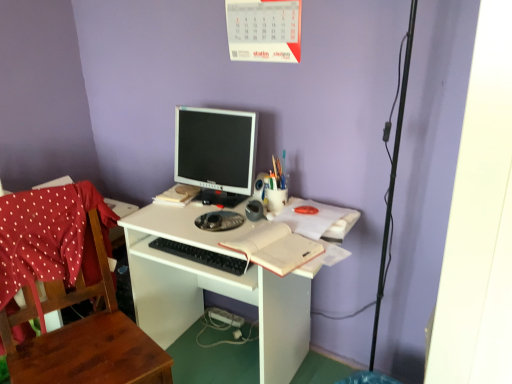
Question: Is white matte notebook at center placed right next to wooden chair at left?

Choices:
 (A) yes
 (B) no

Answer: (B)

Question: Does white matte notebook at center appear on the left side of wooden chair at left?

Choices:
 (A) yes
 (B) no

Answer: (B)

Question: Does white matte notebook at center appear on the right side of wooden chair at left?

Choices:
 (A) yes
 (B) no

Answer: (A)

Question: Is white matte notebook at center oriented towards wooden chair at left?

Choices:
 (A) yes
 (B) no

Answer: (B)

Question: Is wooden chair at left completely or partially inside white matte notebook at center?

Choices:
 (A) no
 (B) yes

Answer: (A)

Question: In the image, is white matte desk at center positioned in front of or behind black plastic keyboard at center?

Choices:
 (A) front
 (B) behind

Answer: (A)

Question: Does point (257, 268) appear closer or farther from the camera than point (241, 269)?

Choices:
 (A) farther
 (B) closer

Answer: (B)

Question: In terms of width, does white matte desk at center look wider or thinner when compared to black plastic keyboard at center?

Choices:
 (A) thin
 (B) wide

Answer: (B)

Question: From the image's perspective, is white matte desk at center located above or below black plastic keyboard at center?

Choices:
 (A) above
 (B) below

Answer: (B)

Question: Looking at the image, does multicolored plastic pen holder at center seem bigger or smaller compared to matte black monitor at center?

Choices:
 (A) small
 (B) big

Answer: (A)

Question: Is multicolored plastic pen holder at center situated inside matte black monitor at center or outside?

Choices:
 (A) inside
 (B) outside

Answer: (B)

Question: Would you say multicolored plastic pen holder at center is to the left or to the right of matte black monitor at center in the picture?

Choices:
 (A) left
 (B) right

Answer: (B)

Question: Considering the positions of multicolored plastic pen holder at center and matte black monitor at center in the image, is multicolored plastic pen holder at center wider or thinner than matte black monitor at center?

Choices:
 (A) wide
 (B) thin

Answer: (B)

Question: From the image's perspective, is matte black monitor at center located above or below wooden chair at left?

Choices:
 (A) below
 (B) above

Answer: (B)

Question: Is matte black monitor at center inside the boundaries of wooden chair at left, or outside?

Choices:
 (A) inside
 (B) outside

Answer: (B)